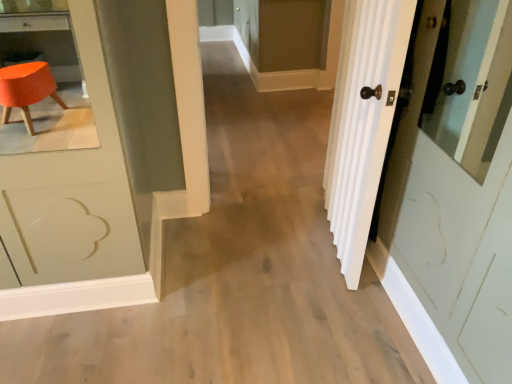
You are a GUI agent. You are given a task and a screenshot of the screen. Output one action in this format:
    pyautogui.click(x=<x>, y=<y>)
    Task: Click on the vacant area in front of matte brown screen door at upper center
    
    Given the screenshot: What is the action you would take?
    pyautogui.click(x=263, y=109)